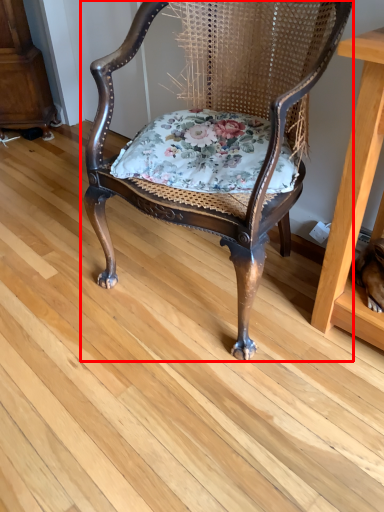
Question: From the image's perspective, what is the correct spatial relationship of chair (annotated by the red box) in relation to blanket?

Choices:
 (A) below
 (B) above

Answer: (B)